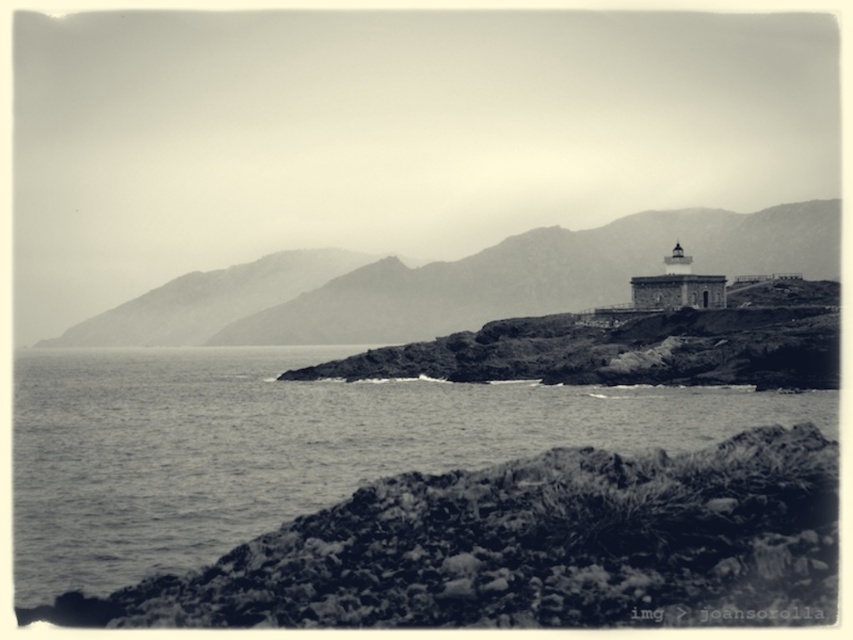
Does smooth water at lower left appear on the left side of rugged stone mountain at center?

Correct, you'll find smooth water at lower left to the left of rugged stone mountain at center.

Is point (151, 461) farther from camera compared to point (392, 285)?

No, it is not.

You are a GUI agent. You are given a task and a screenshot of the screen. Output one action in this format:
    pyautogui.click(x=<x>, y=<y>)
    Task: Click on the smooth water at lower left
    Image resolution: width=853 pixels, height=640 pixels.
    Given the screenshot: What is the action you would take?
    pyautogui.click(x=282, y=445)